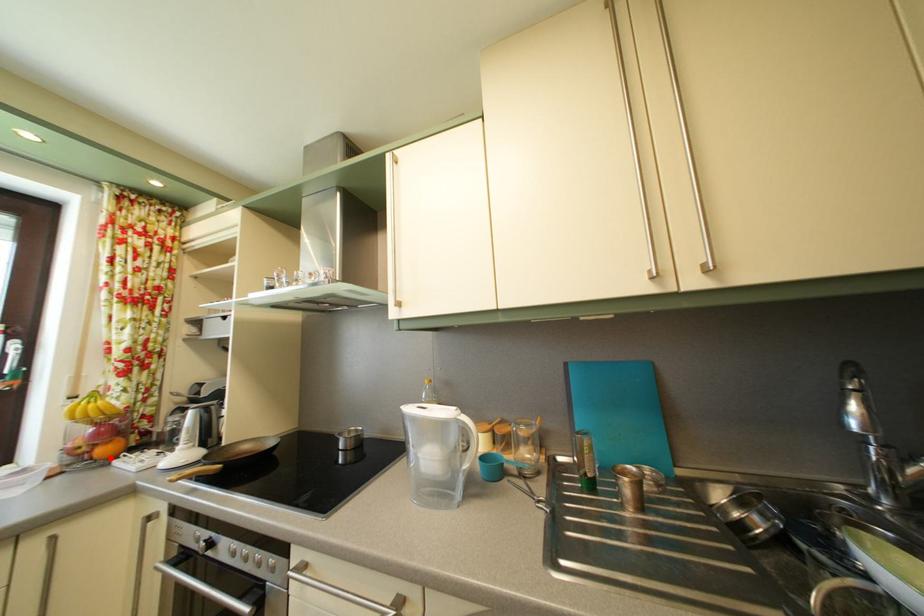
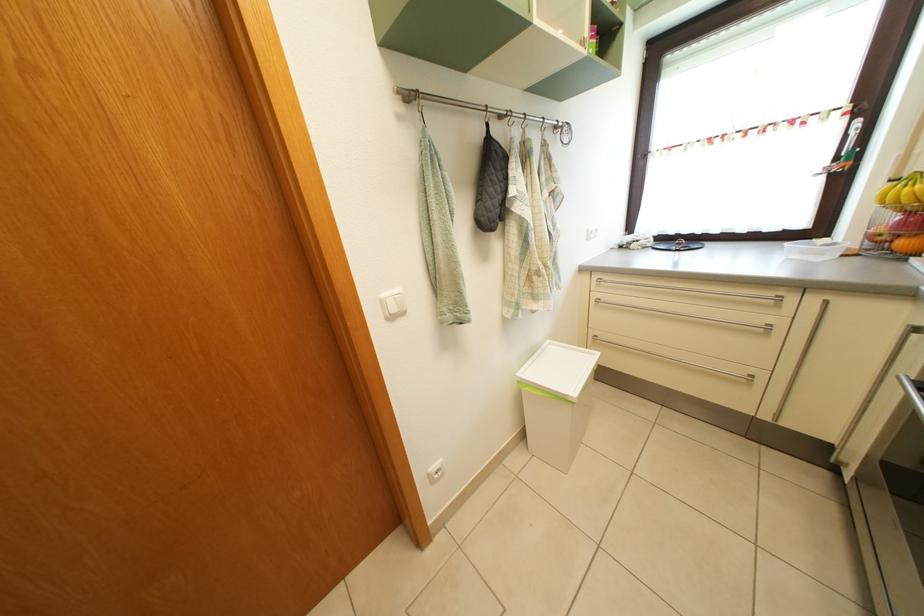
Question: I am providing you with two images of the same scene from different viewpoints. Image1 has a red point marked. In image2, the corresponding 3D location appears at what relative position? Reply with the corresponding letter.

Choices:
 (A) Closer
 (B) Farther

Answer: (B)